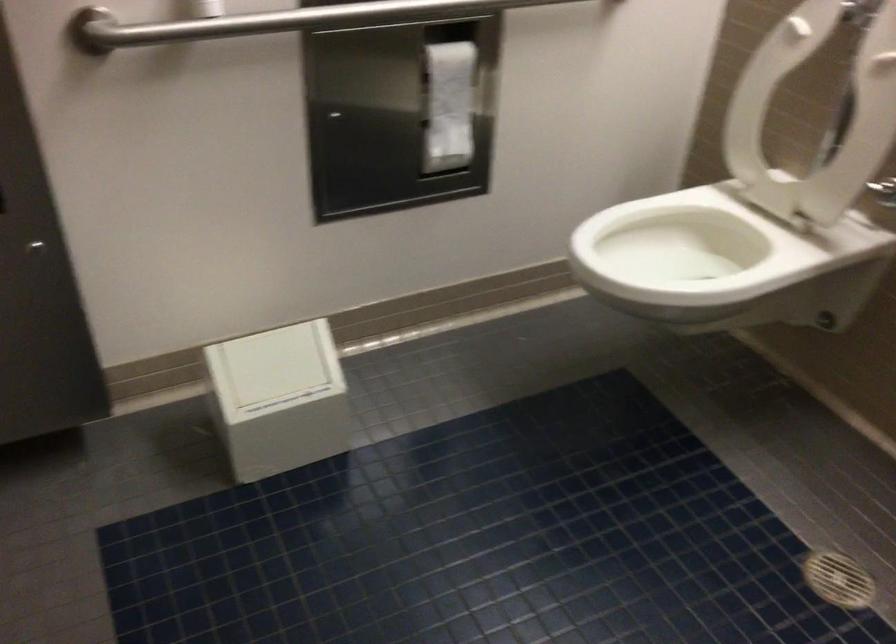
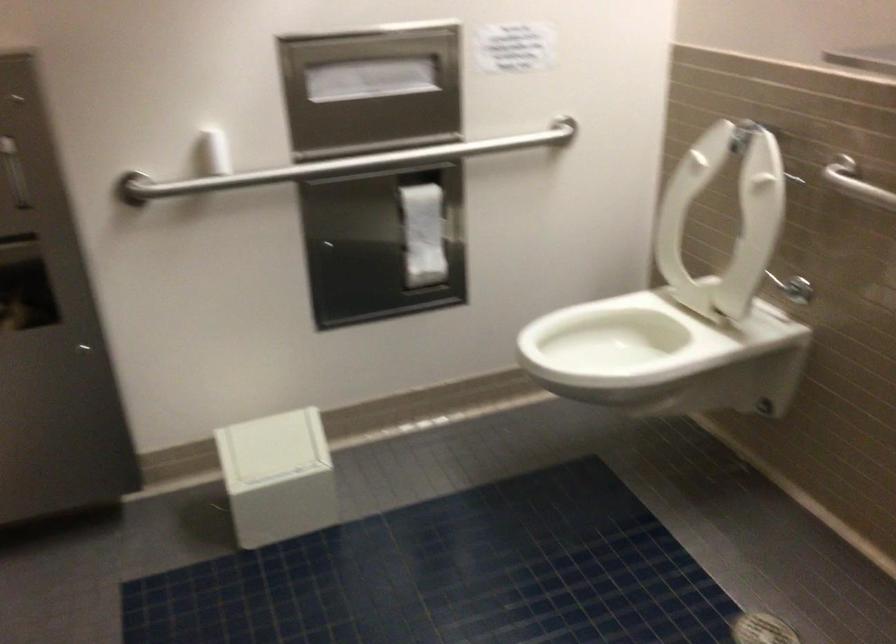
Find the pixel in the second image that matches (x=798, y=102) in the first image.

(724, 219)